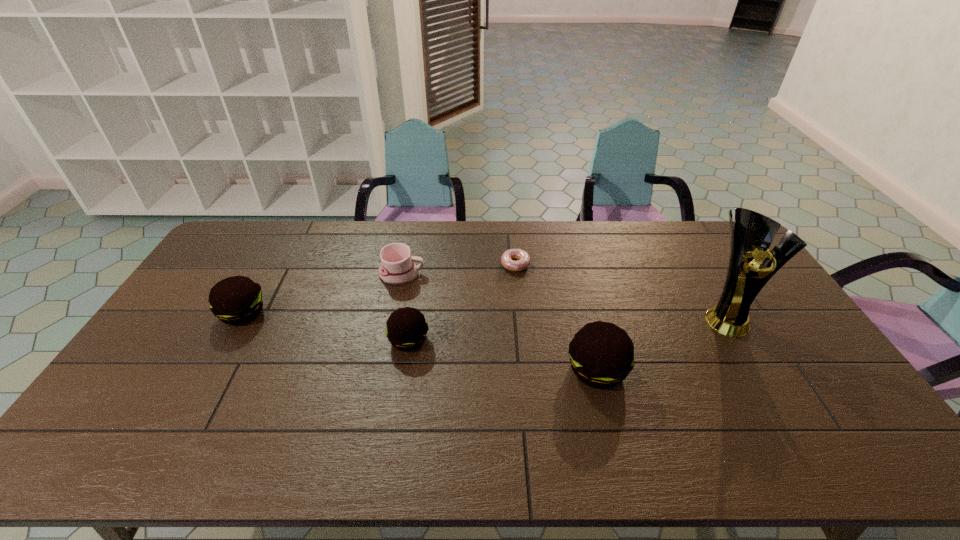
The image size is (960, 540). I want to click on vacant spot to place a patty on the right, so click(812, 404).